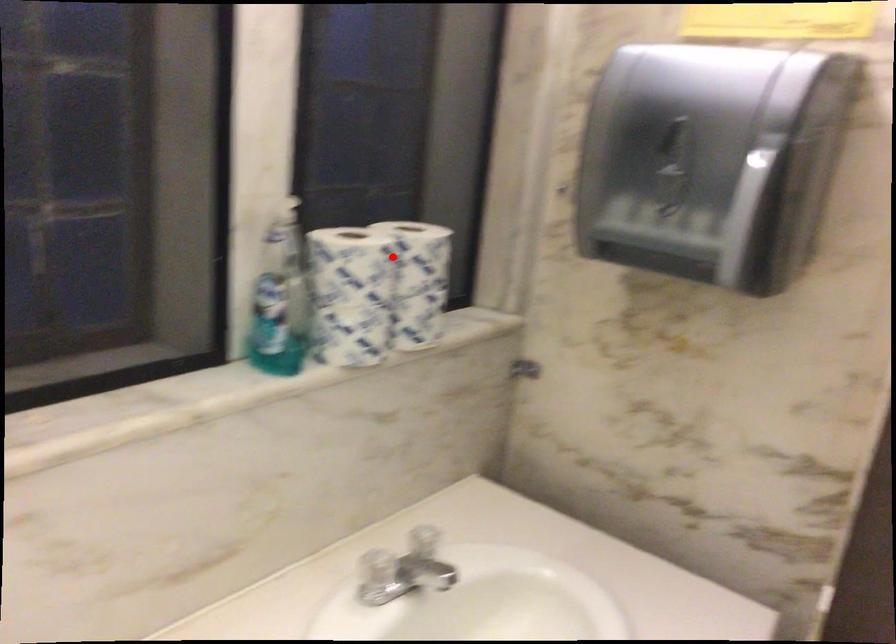
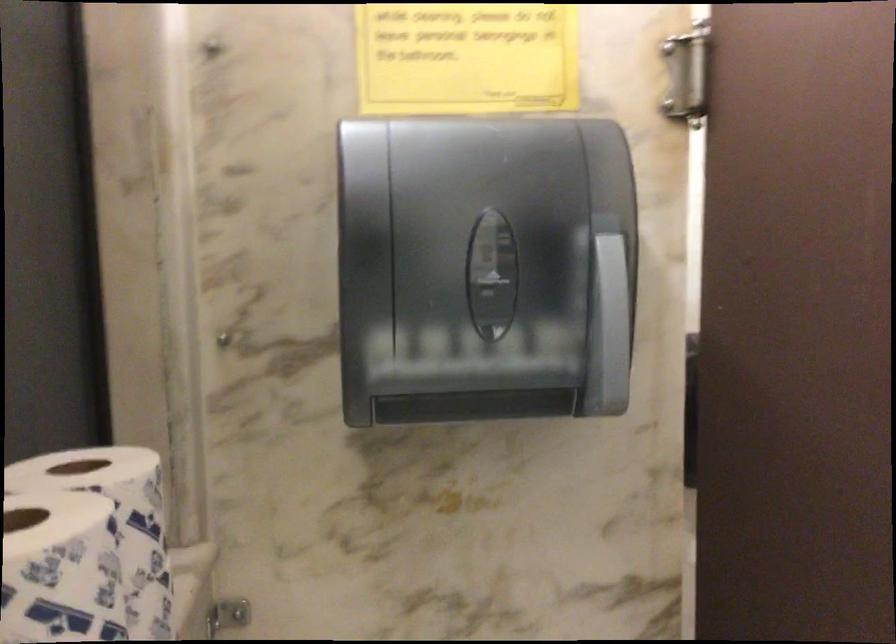
Find the pixel in the second image that matches the highlighted location in the first image.

(117, 522)